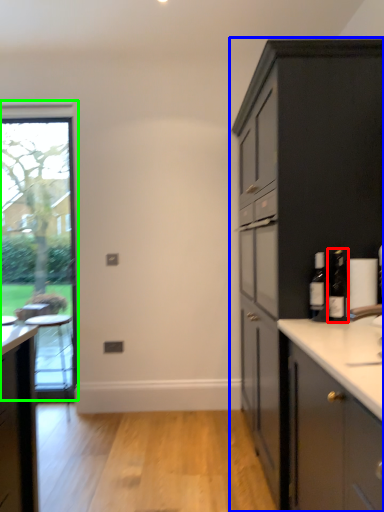
Question: Which object is the farthest from bottle (highlighted by a red box)? Choose among these: cabinetry (highlighted by a blue box) or window (highlighted by a green box).

Choices:
 (A) cabinetry
 (B) window

Answer: (B)